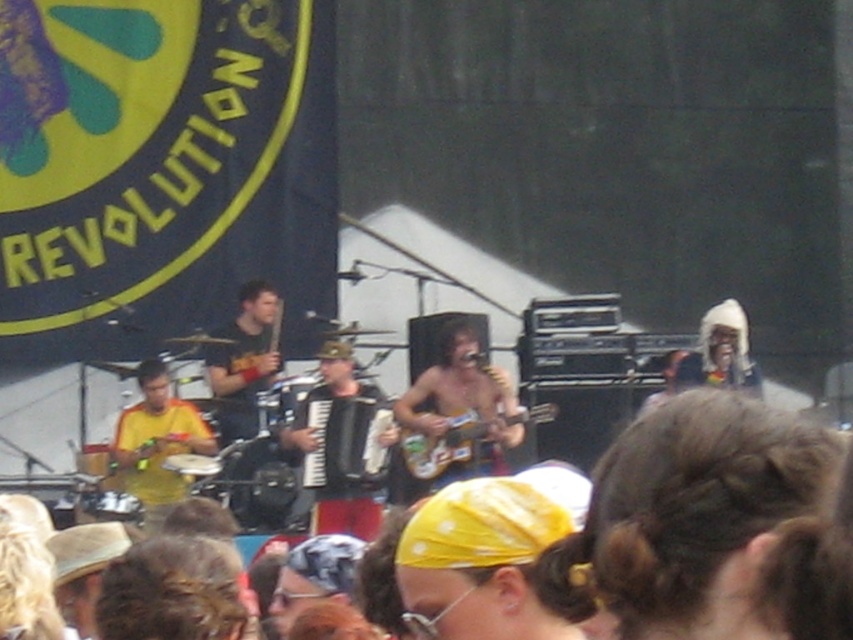
Question: Considering the relative positions of shiny gold guitar at center and matte black guitar at center in the image provided, where is shiny gold guitar at center located with respect to matte black guitar at center?

Choices:
 (A) left
 (B) right

Answer: (B)

Question: Which object appears farthest from the camera in this image?

Choices:
 (A) brown hair at lower left
 (B) matte black guitar at center
 (C) yellow matte shirt at left

Answer: (B)

Question: Considering the real-world distances, which object is farthest from the brown hair at lower left?

Choices:
 (A) yellow fabric headband at lower center
 (B) patterned fabric headband at center
 (C) black matte accordion at center

Answer: (C)

Question: Which point is farther to the camera?

Choices:
 (A) patterned fabric headband at center
 (B) shiny gold guitar at center
 (C) yellow fabric headband at lower center
 (D) brown hair at lower left

Answer: (B)

Question: Observing the image, what is the correct spatial positioning of brown hair at lower left in reference to glossy wood guitar at center?

Choices:
 (A) below
 (B) above

Answer: (A)

Question: Does patterned fabric headband at center have a larger size compared to glossy wood guitar at center?

Choices:
 (A) no
 (B) yes

Answer: (B)